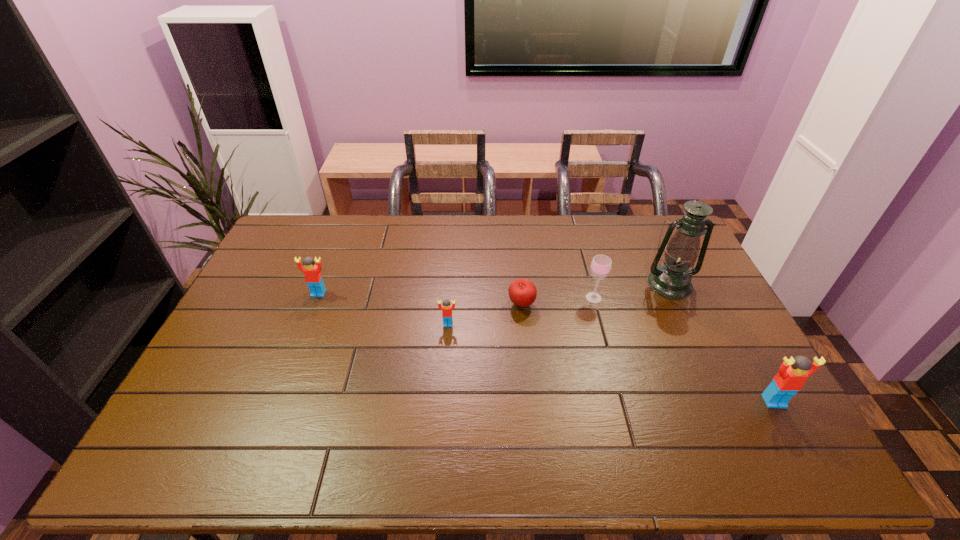
Image resolution: width=960 pixels, height=540 pixels. In order to click on free space that is in between the nearest Lego and the third object from left to right in this screenshot , I will do `click(648, 353)`.

Where is `empty space that is in between the second nearest object and the rightmost Lego`? This screenshot has width=960, height=540. empty space that is in between the second nearest object and the rightmost Lego is located at coordinates (611, 363).

I want to click on the third closest object to the second shortest Lego, so click(x=601, y=265).

At what (x,y) coordinates should I click in order to perform the action: click on the fifth closest object to the nearest Lego. Please return your answer as a coordinate pair (x, y). Looking at the image, I should click on (313, 277).

Image resolution: width=960 pixels, height=540 pixels. Identify the location of Lego that is the closest to the second Lego from left to right. (313, 277).

I want to click on Lego object that ranks as the closest to the fourth object from left to right, so click(x=446, y=309).

At what (x,y) coordinates should I click in order to perform the action: click on free space that satisfies the following two spatial constraints: 1. on the face of the apple; 2. on the right side of the leftmost Lego. Please return your answer as a coordinate pair (x, y). This screenshot has height=540, width=960. Looking at the image, I should click on (314, 305).

This screenshot has width=960, height=540. I want to click on free spot that satisfies the following two spatial constraints: 1. on the face of the leftmost Lego; 2. on the left side of the apple, so click(x=314, y=305).

Image resolution: width=960 pixels, height=540 pixels. In order to click on free location that satisfies the following two spatial constraints: 1. on the face of the fourth object from left to right; 2. on the left side of the leftmost Lego in this screenshot , I will do `click(317, 298)`.

This screenshot has height=540, width=960. Find the location of `vacant position in the image that satisfies the following two spatial constraints: 1. on the back side of the third object from left to right; 2. on the right side of the fourth object from left to right`. vacant position in the image that satisfies the following two spatial constraints: 1. on the back side of the third object from left to right; 2. on the right side of the fourth object from left to right is located at coordinates (521, 298).